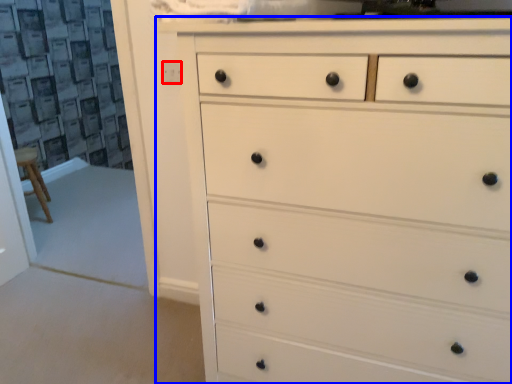
Question: Among these objects, which one is nearest to the camera, knob (highlighted by a red box) or chest of drawers (highlighted by a blue box)?

Choices:
 (A) knob
 (B) chest of drawers

Answer: (B)